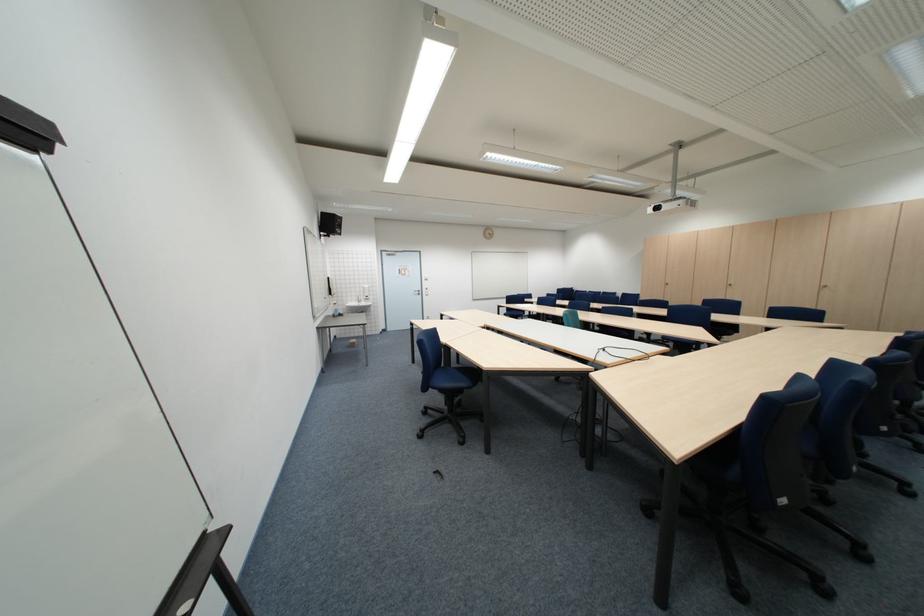
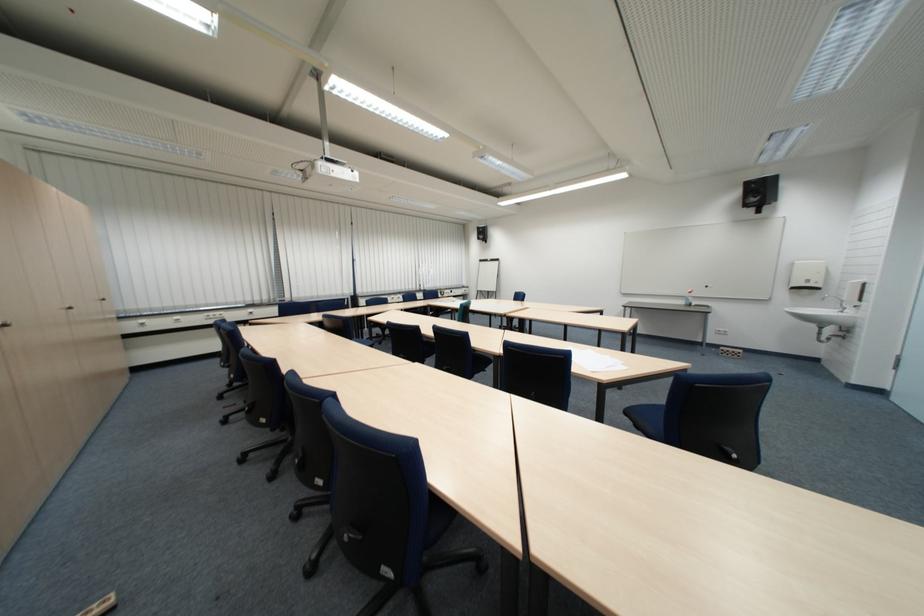
Question: I am providing you with two images of the same scene from different viewpoints. Please identify which objects are invisible in image2.

Choices:
 (A) white paper towel dispenser
 (B) spray bottle
 (C) yellow honey bottle
 (D) blue chair sitting surface

Answer: (D)